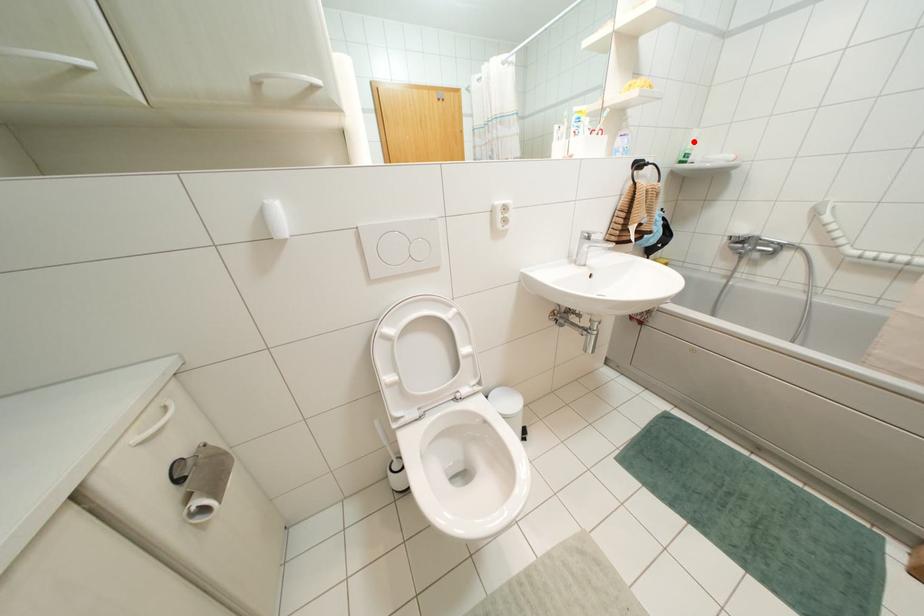
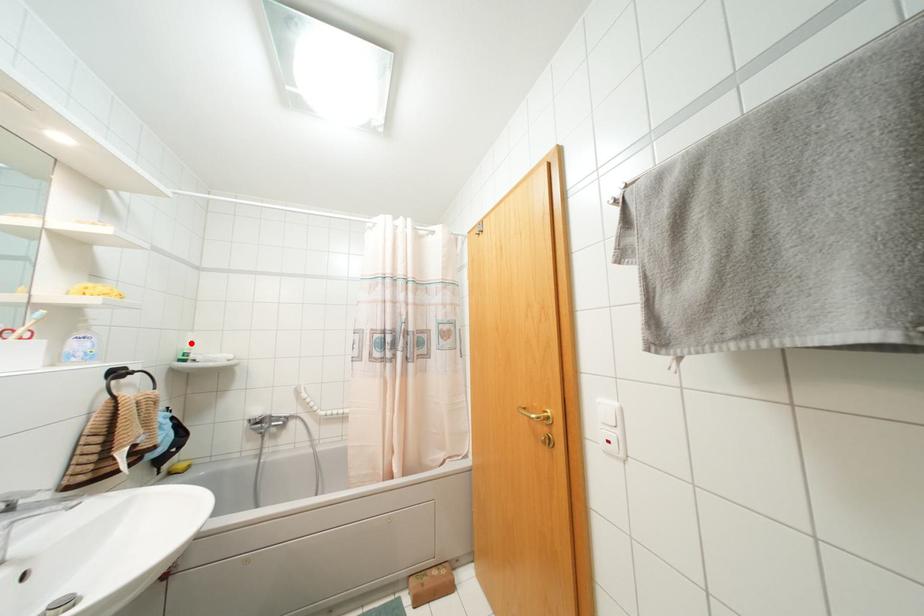
I am providing you with two images of the same scene from different viewpoints. A red point is marked on the first image and another point is marked on the second image. Is the red point in image1 aligned with the point shown in image2?

Yes